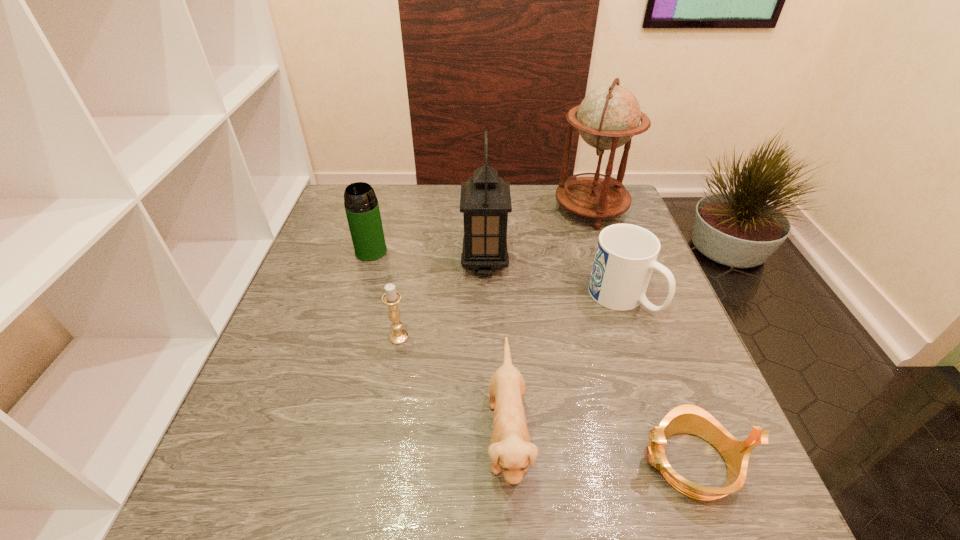
I want to click on globe, so click(608, 117).

Locate an element on the screen. The image size is (960, 540). lantern is located at coordinates (485, 201).

Locate an element on the screen. Image resolution: width=960 pixels, height=540 pixels. the leftmost object is located at coordinates (361, 205).

This screenshot has width=960, height=540. What are the coordinates of `the fifth shortest object` in the screenshot? It's located at (361, 205).

Identify the location of mug. Image resolution: width=960 pixels, height=540 pixels. (626, 254).

The height and width of the screenshot is (540, 960). In order to click on the sixth object from right to left in this screenshot , I will do `click(391, 298)`.

Find the location of a particular element. The width and height of the screenshot is (960, 540). the fifth farthest object is located at coordinates (391, 298).

The image size is (960, 540). In order to click on puppy in this screenshot , I will do `click(510, 449)`.

This screenshot has width=960, height=540. In order to click on the shortest object in this screenshot , I will do `click(687, 418)`.

Where is `free region located on the surface of the globe`? The width and height of the screenshot is (960, 540). free region located on the surface of the globe is located at coordinates click(439, 210).